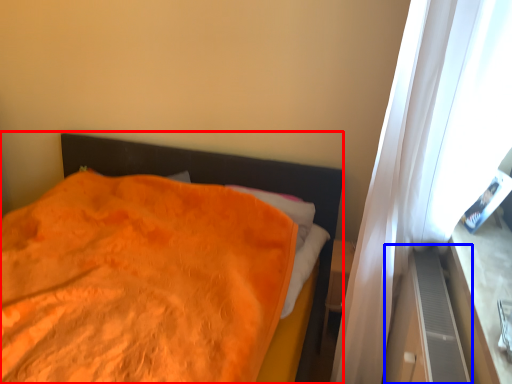
Question: Which object is closer to the camera taking this photo, bed (highlighted by a red box) or dresser (highlighted by a blue box)?

Choices:
 (A) bed
 (B) dresser

Answer: (A)